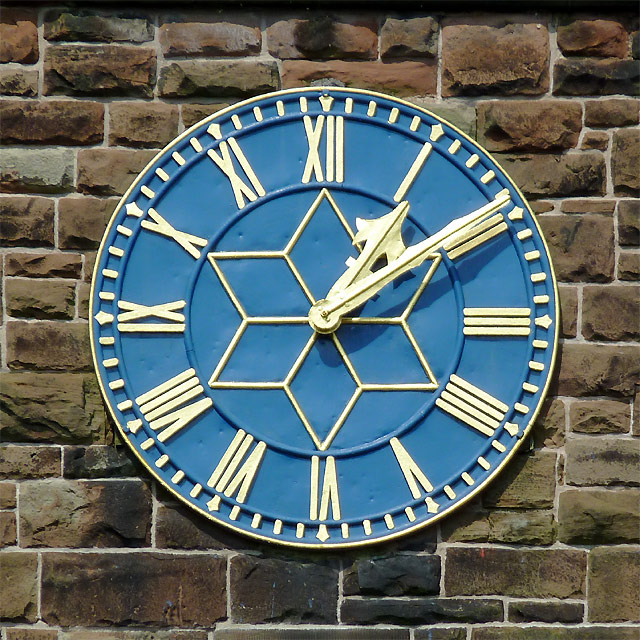
This screenshot has width=640, height=640. In order to click on wall clock in this screenshot , I will do `click(344, 370)`.